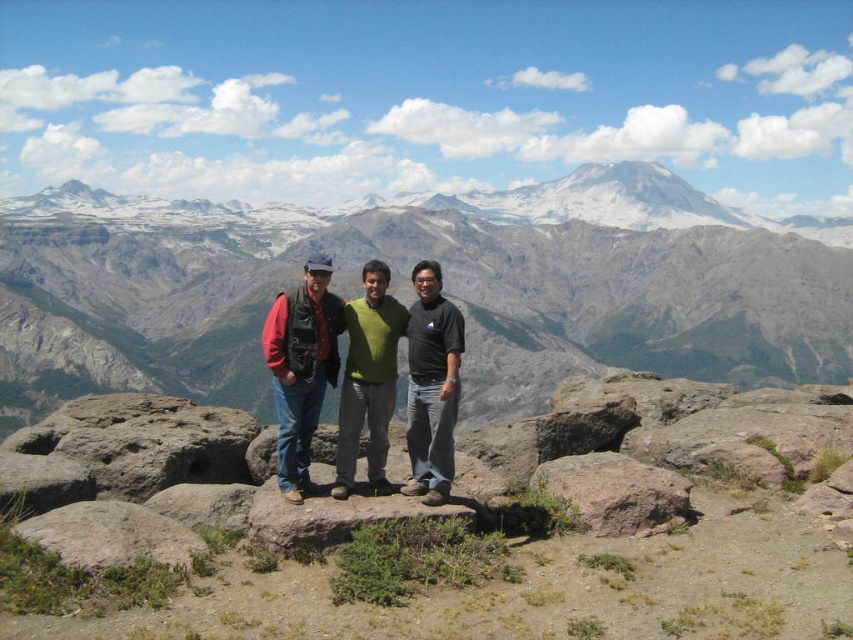
Between point (15, 316) and point (143, 520), which one is positioned behind?

The point (15, 316) is more distant.

What do you see at coordinates (405, 268) in the screenshot? This screenshot has width=853, height=640. I see `gray rocky mountain range at upper center` at bounding box center [405, 268].

Where is `gray rocky mountain range at upper center`? The height and width of the screenshot is (640, 853). gray rocky mountain range at upper center is located at coordinates (405, 268).

Does black matte shirt at center appear under green matte sweater at center?

No.

Is black matte shirt at center to the left of green matte sweater at center from the viewer's perspective?

In fact, black matte shirt at center is to the right of green matte sweater at center.

This screenshot has height=640, width=853. Describe the element at coordinates (431, 385) in the screenshot. I see `black matte shirt at center` at that location.

This screenshot has width=853, height=640. What are the coordinates of `black matte shirt at center` in the screenshot? It's located at (431, 385).

Which of these two, matte black vest at center or brown rough rock at lower right, stands shorter?

brown rough rock at lower right

Who is more forward, [289,458] or [582,513]?

Point [582,513] is more forward.

Is point (311, 282) closer to camera compared to point (654, 516)?

No, (311, 282) is further to viewer.

Where is `matte black vest at center`? This screenshot has height=640, width=853. matte black vest at center is located at coordinates (300, 365).